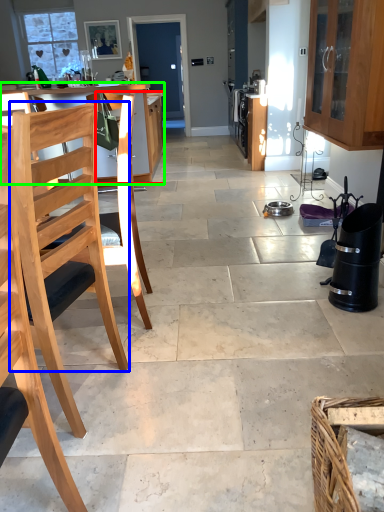
Question: Considering the real-world distances, which object is farthest from cabinetry (highlighted by a red box)? chair (highlighted by a blue box) or table (highlighted by a green box)?

Choices:
 (A) chair
 (B) table

Answer: (A)